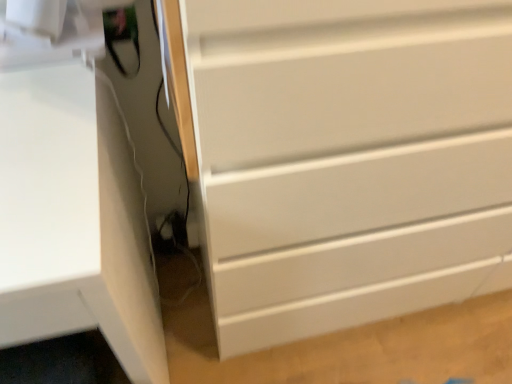
Question: From a real-world perspective, is white matte computer desk at left positioned above or below white matte chest of drawers at center?

Choices:
 (A) below
 (B) above

Answer: (A)

Question: Would you say white matte computer desk at left is inside or outside white matte chest of drawers at center?

Choices:
 (A) outside
 (B) inside

Answer: (A)

Question: In terms of size, does white matte computer desk at left appear bigger or smaller than white matte chest of drawers at center?

Choices:
 (A) small
 (B) big

Answer: (A)

Question: From a real-world perspective, relative to white matte computer desk at left, is white matte chest of drawers at center vertically above or below?

Choices:
 (A) below
 (B) above

Answer: (B)

Question: Relative to white matte computer desk at left, is white matte chest of drawers at center in front or behind?

Choices:
 (A) behind
 (B) front

Answer: (A)

Question: From the image's perspective, is white matte chest of drawers at center located above or below white matte computer desk at left?

Choices:
 (A) above
 (B) below

Answer: (A)

Question: Looking at their shapes, would you say white matte chest of drawers at center is wider or thinner than white matte computer desk at left?

Choices:
 (A) wide
 (B) thin

Answer: (B)